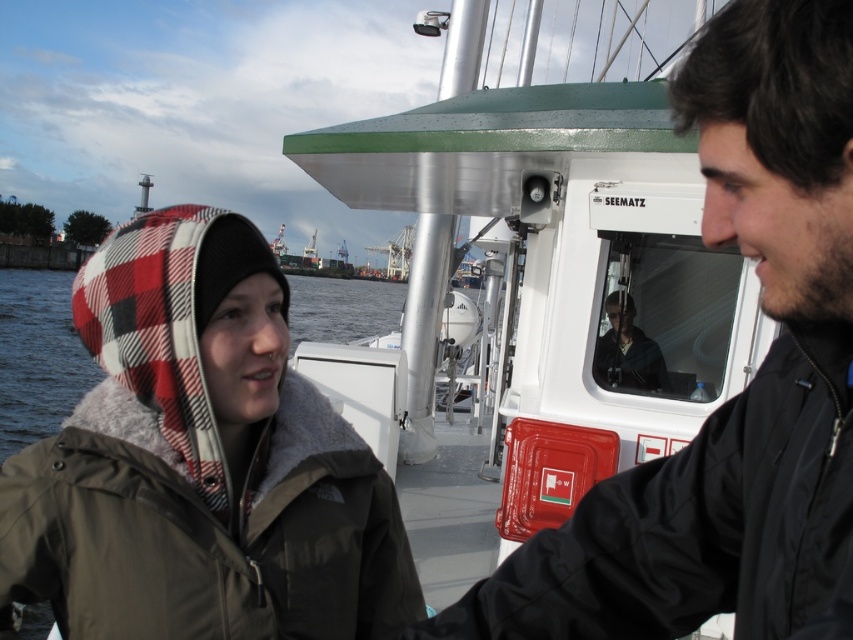
Question: Which point is farther to the camera?

Choices:
 (A) plaid fabric water at left
 (B) matte black jacket at center
 (C) plaid woolen hat at left
 (D) black matte jacket at center

Answer: (A)

Question: Considering the relative positions of plaid woolen hat at left and black matte jacket at center in the image provided, where is plaid woolen hat at left located with respect to black matte jacket at center?

Choices:
 (A) right
 (B) left

Answer: (B)

Question: Considering the real-world distances, which object is farthest from the plaid fabric water at left?

Choices:
 (A) matte black jacket at center
 (B) plaid woolen hat at left
 (C) black matte jacket at center

Answer: (C)

Question: Is black matte jacket at center in front of matte black jacket at center?

Choices:
 (A) yes
 (B) no

Answer: (A)

Question: Which point is closer to the camera?

Choices:
 (A) (1, 593)
 (B) (392, 284)
 (C) (657, 369)
 (D) (704, 77)

Answer: (D)

Question: From the image, what is the correct spatial relationship of black matte jacket at center in relation to plaid fabric water at left?

Choices:
 (A) below
 (B) above

Answer: (A)